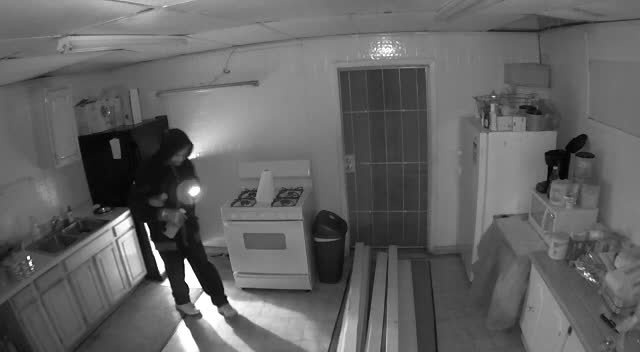
Locate an element on the screen. This screenshot has width=640, height=352. cabinet doors is located at coordinates tap(38, 323), tap(68, 309), tap(86, 295), tap(113, 274), tap(134, 255).